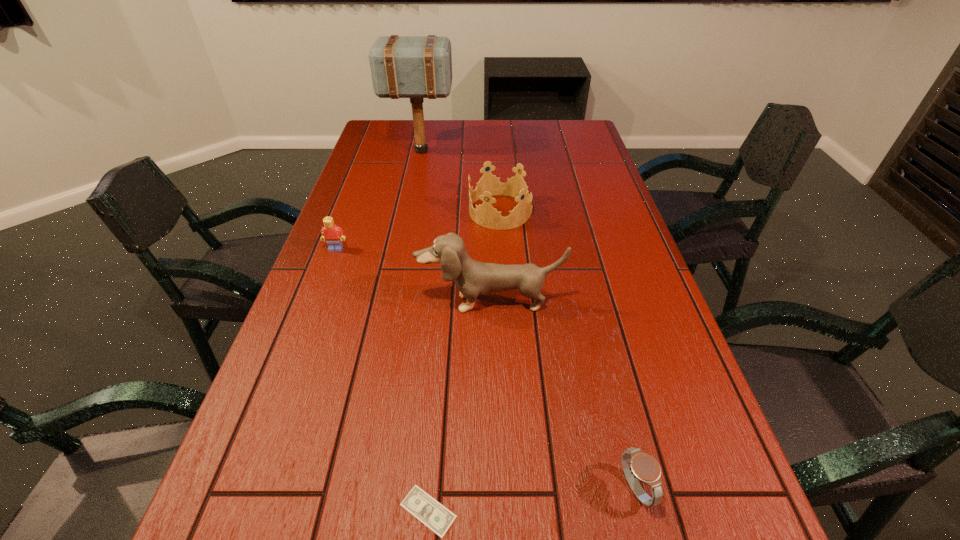
The height and width of the screenshot is (540, 960). In order to click on the farthest object in this screenshot , I will do `click(416, 67)`.

Identify the location of mallet. (416, 67).

At what (x,y) coordinates should I click in order to perform the action: click on the fourth farthest object. Please return your answer as a coordinate pair (x, y). The height and width of the screenshot is (540, 960). Looking at the image, I should click on (473, 278).

Where is `puppy`? Image resolution: width=960 pixels, height=540 pixels. puppy is located at coordinates (473, 278).

You are a GUI agent. You are given a task and a screenshot of the screen. Output one action in this format:
    pyautogui.click(x=<x>, y=<y>)
    Task: Click on the second farthest object
    Image resolution: width=960 pixels, height=540 pixels.
    Given the screenshot: What is the action you would take?
    pyautogui.click(x=485, y=215)

Find the location of a particular element. the fourth tallest object is located at coordinates (333, 235).

Find the location of a particular element. The image size is (960, 540). Lego is located at coordinates (333, 235).

Where is `watch`? Image resolution: width=960 pixels, height=540 pixels. watch is located at coordinates (637, 465).

Find the location of a particular element. the second shortest object is located at coordinates [x=637, y=465].

The image size is (960, 540). Identify the location of the shortest object. (435, 516).